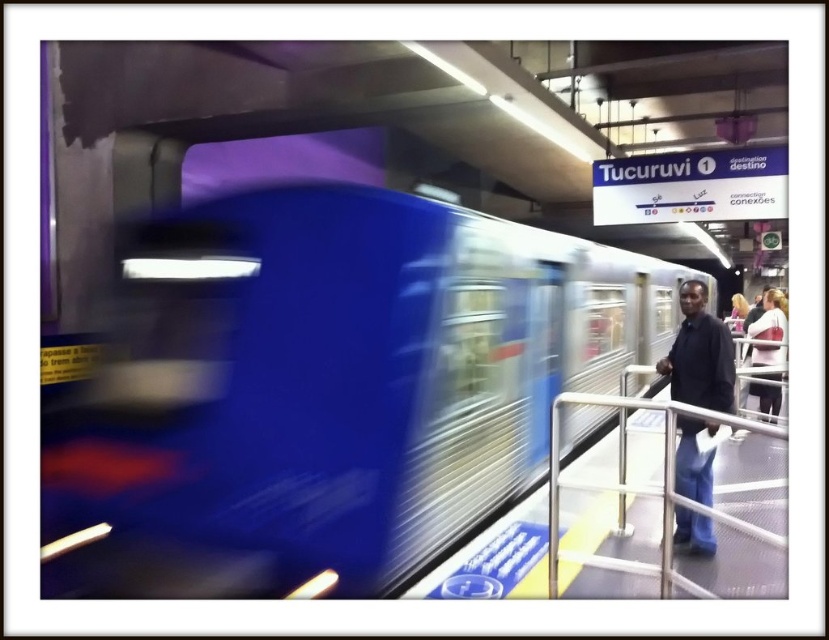
Question: Can you confirm if metallic silver railing at right is wider than matte black jacket at right?

Choices:
 (A) yes
 (B) no

Answer: (A)

Question: In this image, where is metallic blue train at center located relative to metallic silver railing at right?

Choices:
 (A) below
 (B) above

Answer: (B)

Question: Among these points, which one is farthest from the camera?

Choices:
 (A) (750, 381)
 (B) (696, 308)

Answer: (A)

Question: Which point appears closest to the camera in this image?

Choices:
 (A) (308, 444)
 (B) (768, 330)
 (C) (701, 340)
 (D) (772, 536)

Answer: (D)

Question: From the image, what is the correct spatial relationship of metallic blue train at center in relation to dark blue jeans at right?

Choices:
 (A) below
 (B) above

Answer: (B)

Question: Among these points, which one is farthest from the camera?

Choices:
 (A) (750, 392)
 (B) (623, 474)
 (C) (493, 476)

Answer: (A)